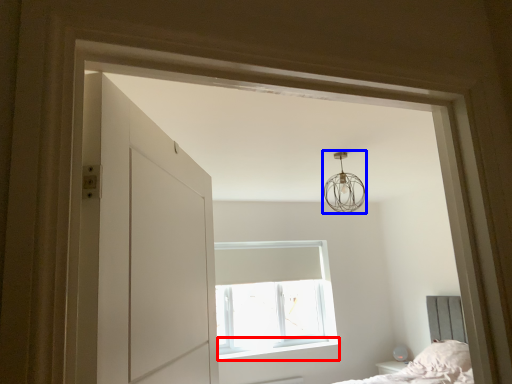
Question: Which of the following is the farthest to the observer, window sill (highlighted by a red box) or lamp (highlighted by a blue box)?

Choices:
 (A) window sill
 (B) lamp

Answer: (A)